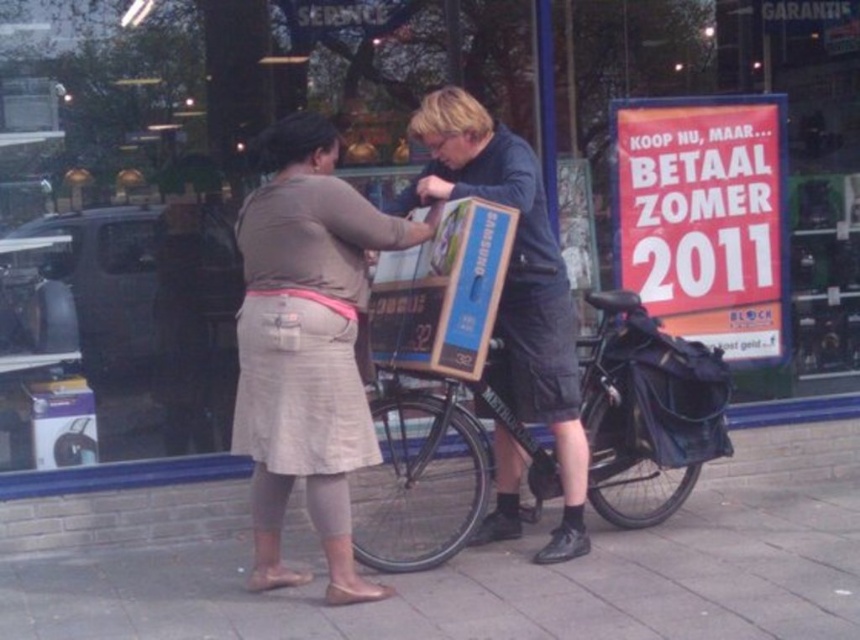
Which is behind, point (308, 337) or point (496, 378)?

The point (496, 378) is more distant.

Is beige fabric skirt at center to the left of matte black bicycle at center from the viewer's perspective?

Yes, beige fabric skirt at center is to the left of matte black bicycle at center.

Where is `beige fabric skirt at center`? beige fabric skirt at center is located at coordinates (306, 346).

Who is lower down, smooth concrete pavement at center or beige fabric skirt at center?

smooth concrete pavement at center is below.

Find the location of a particular element. The width and height of the screenshot is (860, 640). smooth concrete pavement at center is located at coordinates (441, 572).

Where is `smooth concrete pavement at center`? The width and height of the screenshot is (860, 640). smooth concrete pavement at center is located at coordinates (441, 572).

Identify the location of smooth concrete pavement at center. The image size is (860, 640). (441, 572).

Does smooth concrete pavement at center have a larger size compared to black matte bicycle at center?

Indeed, smooth concrete pavement at center has a larger size compared to black matte bicycle at center.

Can you confirm if smooth concrete pavement at center is positioned below black matte bicycle at center?

Yes, smooth concrete pavement at center is below black matte bicycle at center.

Which is behind, point (809, 566) or point (464, 536)?

The point (464, 536) is behind.

Find the location of a particular element. smooth concrete pavement at center is located at coordinates (441, 572).